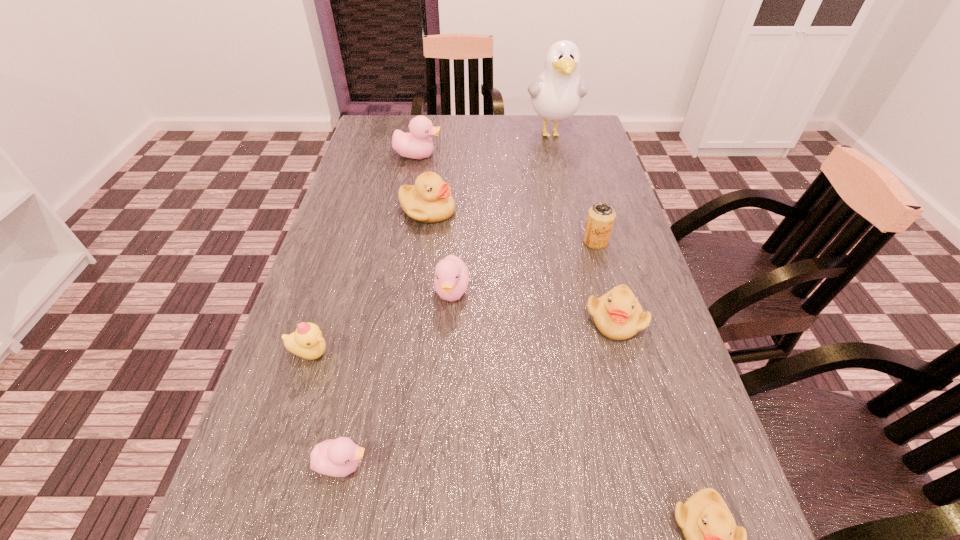
The width and height of the screenshot is (960, 540). I want to click on the leftmost duckling, so click(307, 342).

You are a GUI agent. You are given a task and a screenshot of the screen. Output one action in this format:
    pyautogui.click(x=<x>, y=<y>)
    Task: Click on the eighth farthest object
    Image resolution: width=960 pixels, height=540 pixels.
    Given the screenshot: What is the action you would take?
    pyautogui.click(x=339, y=457)

Where is `the nearest pink duckling`? This screenshot has width=960, height=540. the nearest pink duckling is located at coordinates (339, 457).

At what (x,y) coordinates should I click in order to perform the action: click on vacant space located on the beak of the tallest object. Please return your answer as a coordinate pair (x, y). Looking at the image, I should click on (563, 178).

Identify the location of vacant space located 0.250m on the front-facing side of the farthest duckling. (523, 156).

Find the location of a particular element. Image resolution: width=960 pixels, height=540 pixels. vacant space situated 0.390m on the front-facing side of the sixth nearest duckling is located at coordinates (603, 211).

Identify the location of free space located on the back of the fourth farthest object. (585, 202).

This screenshot has height=540, width=960. In order to click on vacant area located 0.340m on the front-facing side of the second farthest pink duckling in this screenshot , I will do `click(441, 482)`.

The image size is (960, 540). I want to click on vacant space located on the front-facing side of the leftmost object, so click(536, 353).

What are the coordinates of `free spot located 0.350m on the front-facing side of the nearest pink duckling` in the screenshot? It's located at (589, 464).